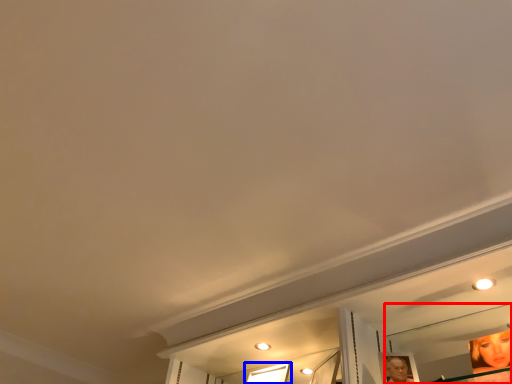
Question: Which object appears farthest to the camera in this image, mirror (highlighted by a red box) or window (highlighted by a blue box)?

Choices:
 (A) mirror
 (B) window

Answer: (B)